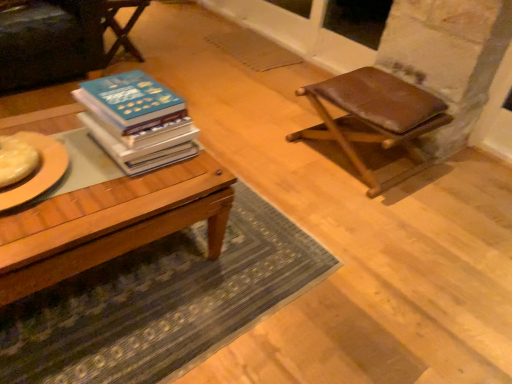
Identify the location of unoccupied region to the right of brown leather stool at right. (464, 190).